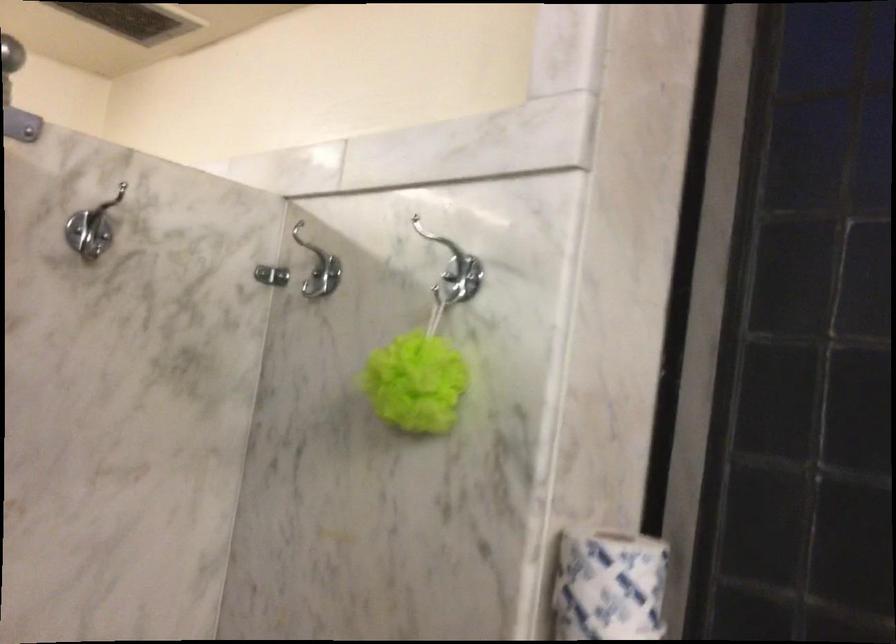
The width and height of the screenshot is (896, 644). What do you see at coordinates (416, 383) in the screenshot?
I see `the green mesh loofah` at bounding box center [416, 383].